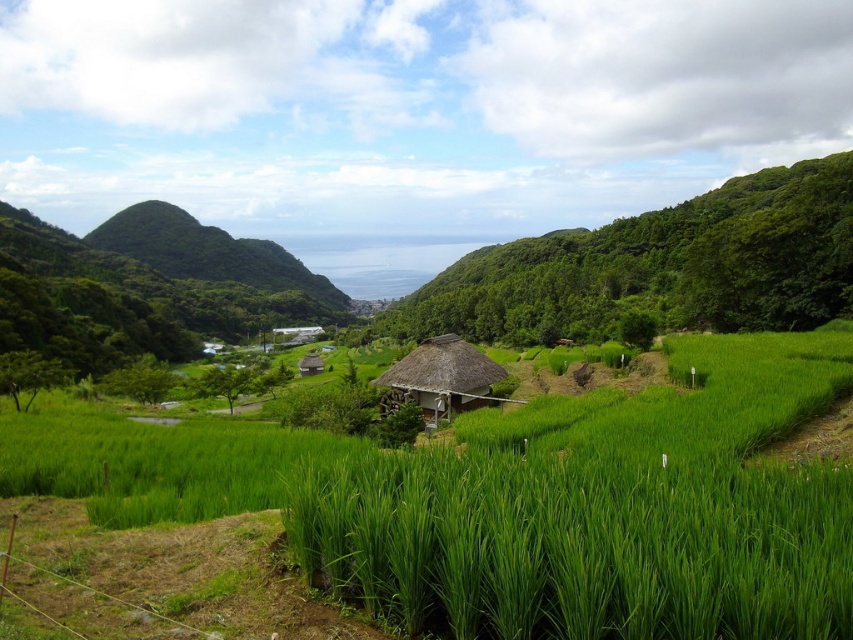
You are a farmer standing in the middle of the rice paddies and you need to reach the thatched roof hut at center. Which direction should you walk to get there from the green grass at center?

The green grass at center is to the right of the thatched roof hut at center, so you should walk to the left to reach the thatched roof hut at center.

In the scene shown: You are a farmer standing in the middle of the rice paddies and you see the green grass at center and the thatched roof hut at center. Which one is closer to you?

The green grass at center is positioned over the thatched roof hut at center, so the green grass at center is closer to you.